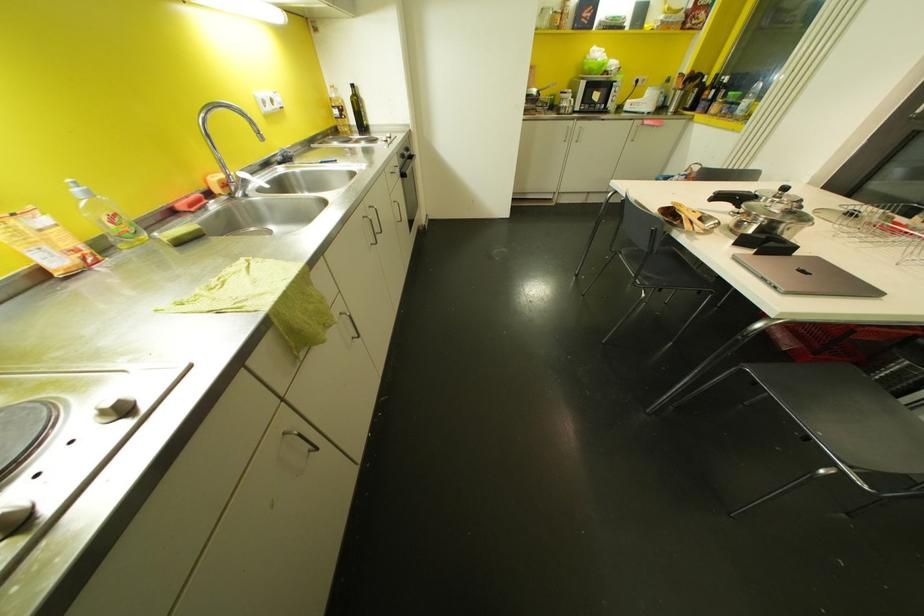
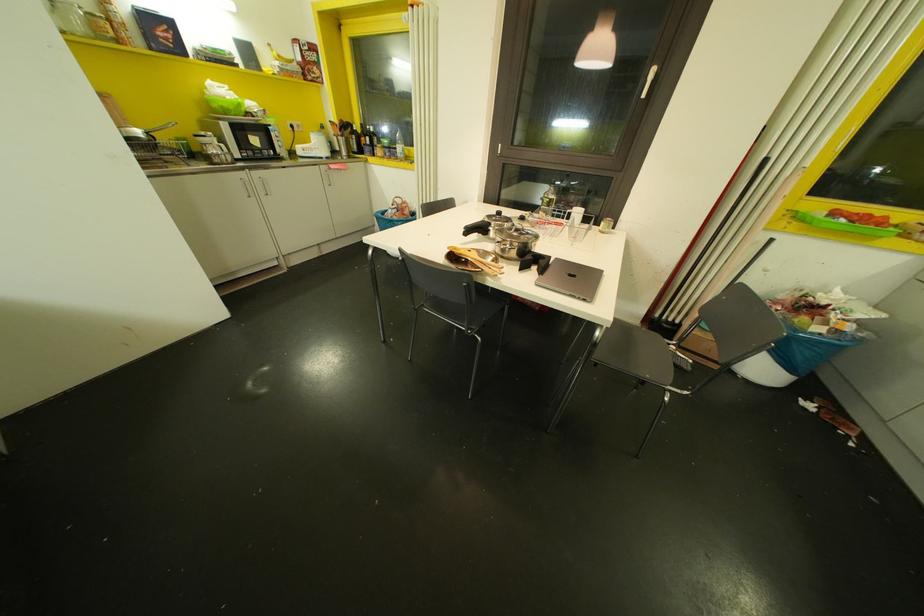
Question: The camera is either moving clockwise (left) or counter-clockwise (right) around the object. The first image is from the beginning of the video and the second image is from the end. Is the camera moving left or right when shooting the video?

Choices:
 (A) Left
 (B) Right

Answer: (A)